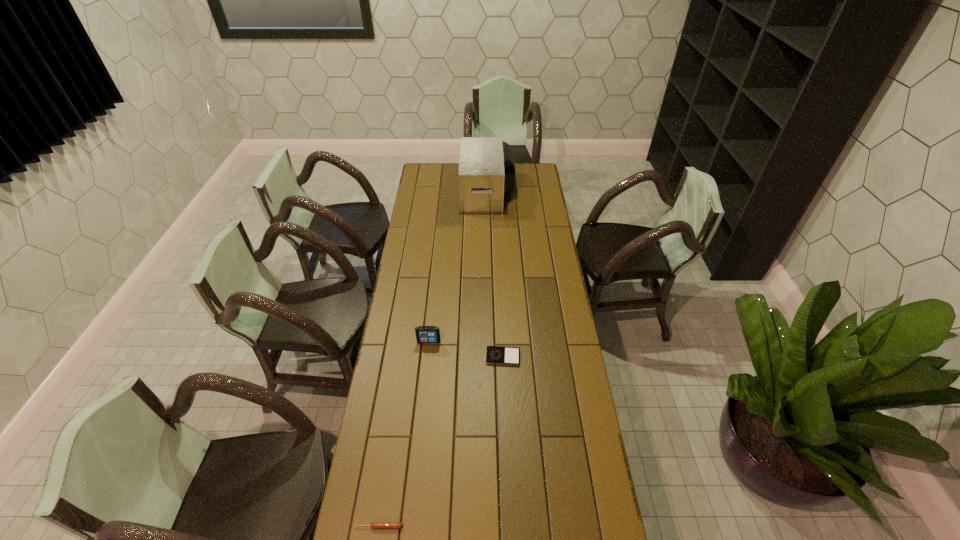
The image size is (960, 540). I want to click on vacant point that satisfies the following two spatial constraints: 1. on the front-facing side of the tallest object; 2. on the front screen of the taller iPod, so click(490, 342).